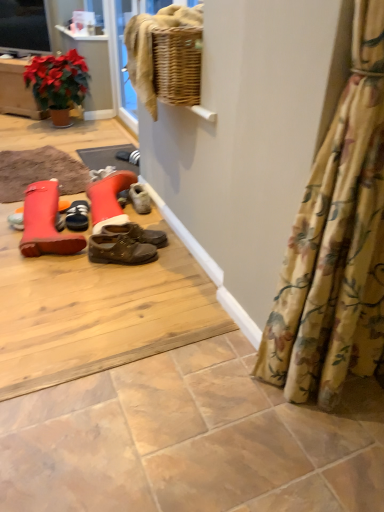
Question: From the image's perspective, is matte black television at upper left below leather boot at left, which is the 1th footwear from front to back?

Choices:
 (A) yes
 (B) no

Answer: (B)

Question: Is matte black television at upper left further to camera compared to leather boot at left, acting as the 2th footwear starting from the back?

Choices:
 (A) yes
 (B) no

Answer: (A)

Question: Could you tell me if matte black television at upper left is facing leather boot at left, which is the 1th footwear from front to back?

Choices:
 (A) yes
 (B) no

Answer: (B)

Question: Would you say matte black television at upper left is outside leather boot at left, acting as the 2th footwear starting from the back?

Choices:
 (A) yes
 (B) no

Answer: (A)

Question: From the image's perspective, is matte black television at upper left above leather boot at left, acting as the 2th footwear starting from the back?

Choices:
 (A) no
 (B) yes

Answer: (B)

Question: From a real-world perspective, relative to leather boot at left, acting as the 2th footwear starting from the back, is floral fabric curtain at lower right vertically above or below?

Choices:
 (A) above
 (B) below

Answer: (A)

Question: In terms of height, does floral fabric curtain at lower right look taller or shorter compared to leather boot at left, acting as the 2th footwear starting from the back?

Choices:
 (A) short
 (B) tall

Answer: (B)

Question: Do you think floral fabric curtain at lower right is within leather boot at left, acting as the 2th footwear starting from the back, or outside of it?

Choices:
 (A) outside
 (B) inside

Answer: (A)

Question: Looking at the image, does floral fabric curtain at lower right seem bigger or smaller compared to leather boot at left, acting as the 2th footwear starting from the back?

Choices:
 (A) big
 (B) small

Answer: (A)

Question: In the image, is leather boot at left, which is the 1th footwear from front to back, positioned in front of or behind black suede shoes at center, which is the 1th footwear in back-to-front order?

Choices:
 (A) behind
 (B) front

Answer: (B)

Question: From the image's perspective, relative to black suede shoes at center, acting as the second footwear starting from the front, is leather boot at left, which is the 1th footwear from front to back, above or below?

Choices:
 (A) below
 (B) above

Answer: (A)

Question: From their relative heights in the image, would you say leather boot at left, acting as the 2th footwear starting from the back, is taller or shorter than black suede shoes at center, acting as the second footwear starting from the front?

Choices:
 (A) tall
 (B) short

Answer: (A)

Question: Is leather boot at left, acting as the 2th footwear starting from the back, to the left or to the right of black suede shoes at center, which is the 1th footwear in back-to-front order, in the image?

Choices:
 (A) left
 (B) right

Answer: (A)

Question: From the image's perspective, is leather boot at left, acting as the 2th footwear starting from the back, positioned above or below matte black television at upper left?

Choices:
 (A) below
 (B) above

Answer: (A)

Question: Considering the positions of leather boot at left, which is the 1th footwear from front to back, and matte black television at upper left in the image, is leather boot at left, which is the 1th footwear from front to back, wider or thinner than matte black television at upper left?

Choices:
 (A) thin
 (B) wide

Answer: (B)